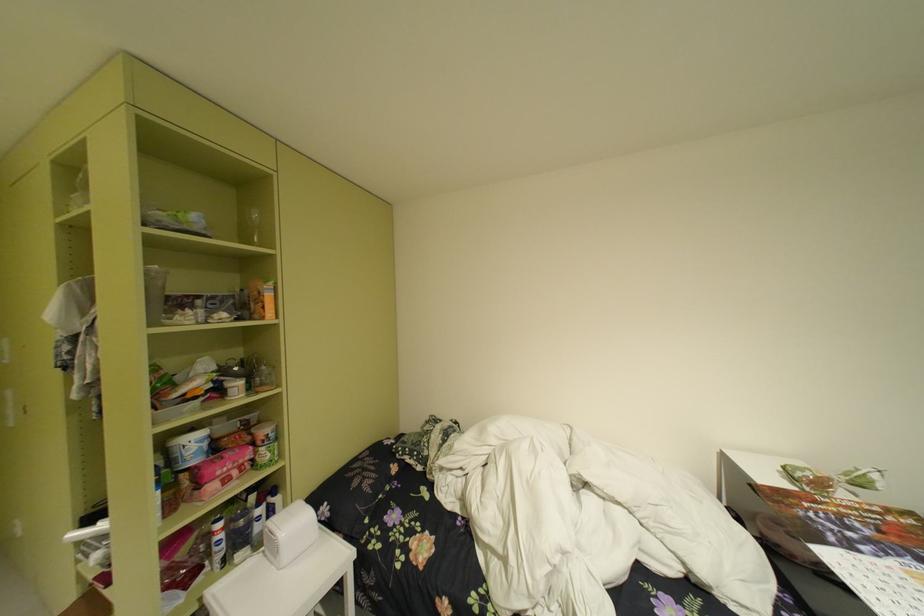
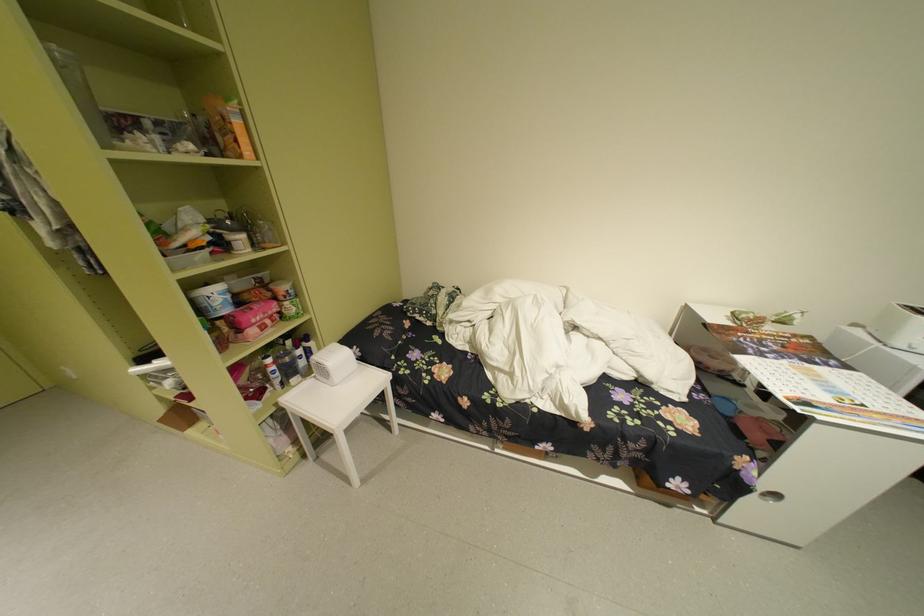
Question: Based on the continuous images, in which direction is the camera rotating? Reply with the corresponding letter.

Choices:
 (A) Left
 (B) Right
 (C) Up
 (D) Down

Answer: (D)